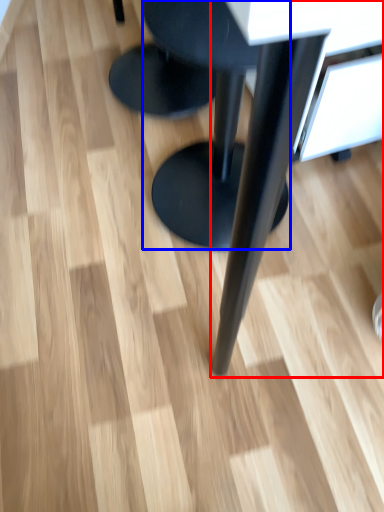
Question: Which point is closer to the camera, table (highlighted by a red box) or stool (highlighted by a blue box)?

Choices:
 (A) table
 (B) stool

Answer: (A)